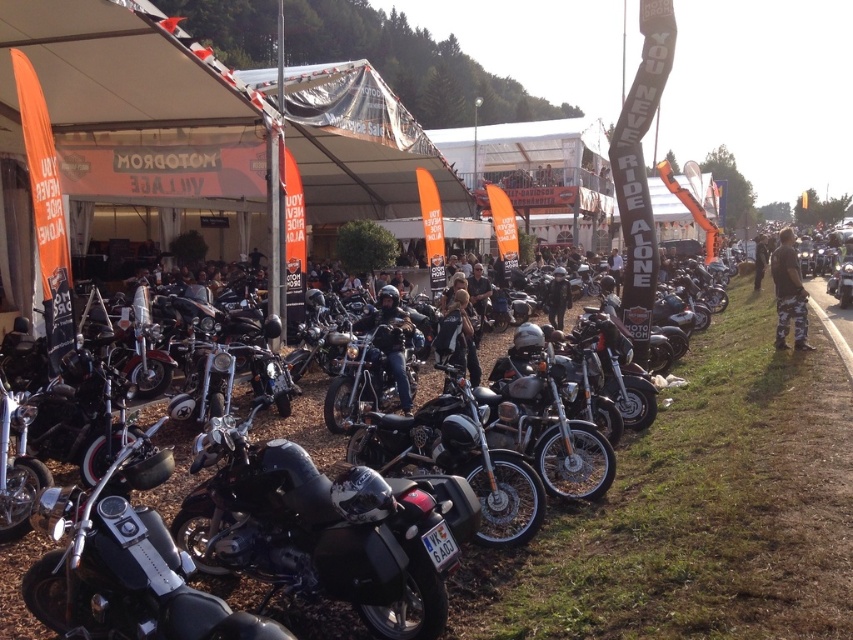
You are a photographer at the motorcycle event. You want to take a photo of the black leather jacket at center and the black matte motorcycle at center without any obstructions. Since both are at the center, which object should you adjust to ensure the other is visible in the frame?

The black matte motorcycle at center is located below the black leather jacket at center. To ensure visibility, you can lower the black leather jacket at center or raise the motorcycle to avoid obstruction.

Looking at this image, you are a photographer at the motorcycle event. You want to take a photo of the black matte motorcycle at center and the black leather jacket at center together. Which object should you position closer to the camera to ensure both are fully visible in the frame?

The black matte motorcycle at center is not as tall as the black leather jacket at center, so you should position the black leather jacket at center closer to the camera to ensure both are fully visible in the frame.

You are a photographer standing at the front of the canopy. You want to take a photo that includes both the black matte motorcycle at center and the black leather jacket at center. Which object should you focus on first to ensure both are in clear view?

The black matte motorcycle at center is closer to the viewer than the black leather jacket at center, so you should focus on the black leather jacket at center first to ensure both are in clear view.